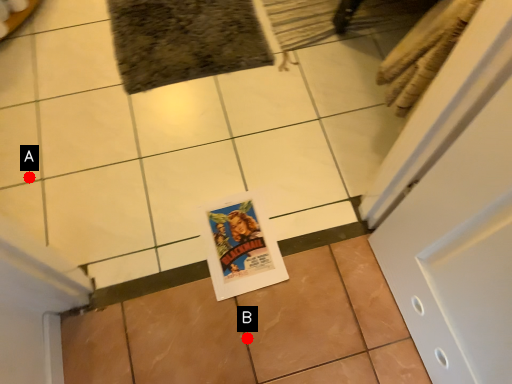
Question: Two points are circled on the image, labeled by A and B beside each circle. Among these points, which one is nearest to the camera?

Choices:
 (A) A is closer
 (B) B is closer

Answer: (B)